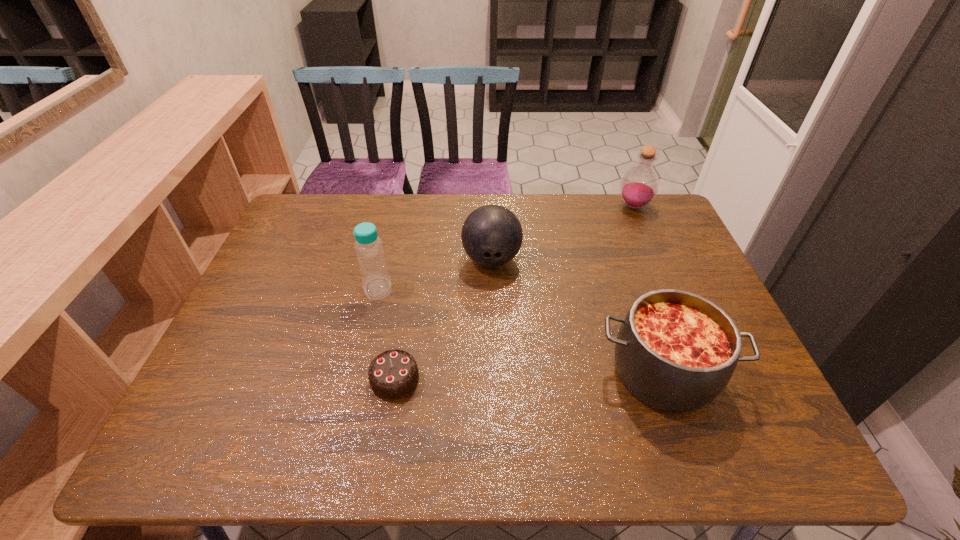
Where is `blank space located 0.170m on the right of the shortest object`? This screenshot has width=960, height=540. blank space located 0.170m on the right of the shortest object is located at coordinates (493, 380).

What are the coordinates of `object that is at the far edge` in the screenshot? It's located at (639, 186).

This screenshot has height=540, width=960. What are the coordinates of `bottle at the right edge` in the screenshot? It's located at (639, 186).

The image size is (960, 540). I want to click on casserole at the right edge, so click(x=676, y=351).

You are a GUI agent. You are given a task and a screenshot of the screen. Output one action in this format:
    pyautogui.click(x=<x>, y=<y>)
    Task: Click on the object that is positioned at the far right corner
    Image resolution: width=960 pixels, height=540 pixels.
    Given the screenshot: What is the action you would take?
    pyautogui.click(x=639, y=186)

Locate an element on the screen. The width and height of the screenshot is (960, 540). free space at the far edge of the desktop is located at coordinates (608, 218).

The width and height of the screenshot is (960, 540). In the image, there is a desktop. Identify the location of free space at the near edge. (478, 427).

Locate an element on the screen. vacant space at the left edge is located at coordinates (258, 347).

You are a GUI agent. You are given a task and a screenshot of the screen. Output one action in this format:
    pyautogui.click(x=<x>, y=<y>)
    Task: Click on the blank space at the far left corner
    
    Given the screenshot: What is the action you would take?
    pyautogui.click(x=319, y=230)

Find the location of a particular element. This screenshot has height=540, width=960. free space at the far right corner of the desktop is located at coordinates (673, 228).